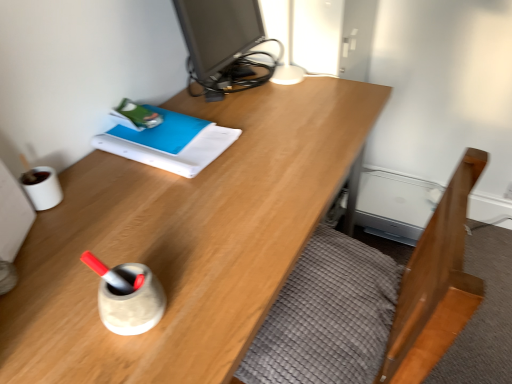
Question: Considering their positions, is matte black monitor at upper center located in front of or behind wooden bed frame at lower right?

Choices:
 (A) behind
 (B) front

Answer: (A)

Question: Considering the positions of point (223, 59) and point (406, 336), is point (223, 59) closer or farther from the camera than point (406, 336)?

Choices:
 (A) closer
 (B) farther

Answer: (B)

Question: Which is farther from the wooden desk at center?

Choices:
 (A) blue matte book at upper left
 (B) matte black monitor at upper center
 (C) wooden bed frame at lower right

Answer: (B)

Question: Estimate the real-world distances between objects in this image. Which object is farther from the blue matte book at upper left?

Choices:
 (A) matte black monitor at upper center
 (B) wooden desk at center
 (C) wooden bed frame at lower right

Answer: (C)